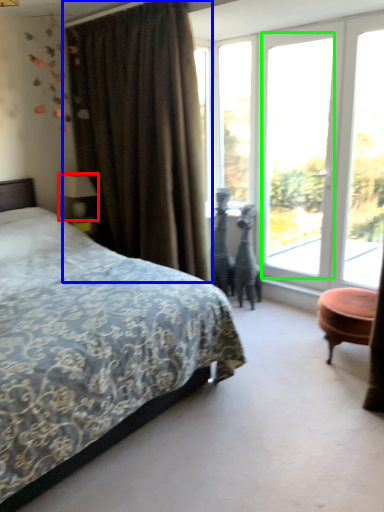
Question: Based on their relative distances, which object is farther from table lamp (highlighted by a red box)? Choose from curtain (highlighted by a blue box) and window (highlighted by a green box).

Choices:
 (A) curtain
 (B) window

Answer: (B)